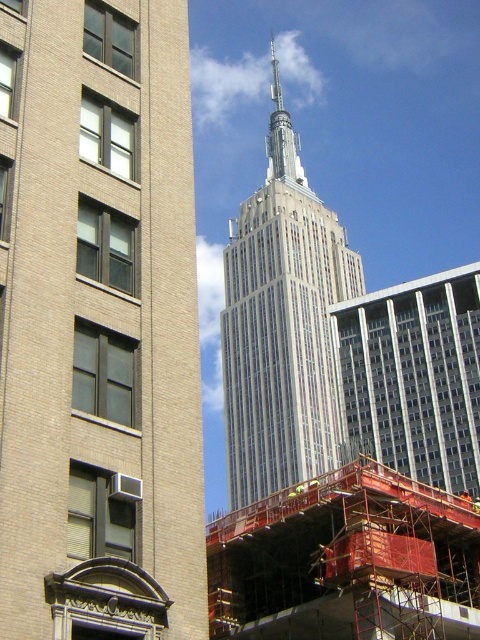
Does white glass tower at center appear on the left side of silver metallic spire at center?

Correct, you'll find white glass tower at center to the left of silver metallic spire at center.

Between point (271, 273) and point (290, 138), which one is positioned behind?

The point (290, 138) is more distant.

Find the location of a particular element. Image resolution: width=480 pixels, height=640 pixels. white glass tower at center is located at coordinates (283, 324).

Does white glass skyscraper at center appear under silver metallic spire at center?

Indeed, white glass skyscraper at center is positioned under silver metallic spire at center.

Find the location of a particular element. The width and height of the screenshot is (480, 640). white glass skyscraper at center is located at coordinates pyautogui.click(x=98, y=324).

Is point (181, 113) positioned behind point (269, 161)?

No, it is not.

Locate an element on the screen. This screenshot has height=640, width=480. white glass skyscraper at center is located at coordinates (98, 324).

Consider the image. Does white glass skyscraper at center appear on the right side of white glass tower at center?

Incorrect, white glass skyscraper at center is not on the right side of white glass tower at center.

This screenshot has width=480, height=640. I want to click on white glass skyscraper at center, so click(x=98, y=324).